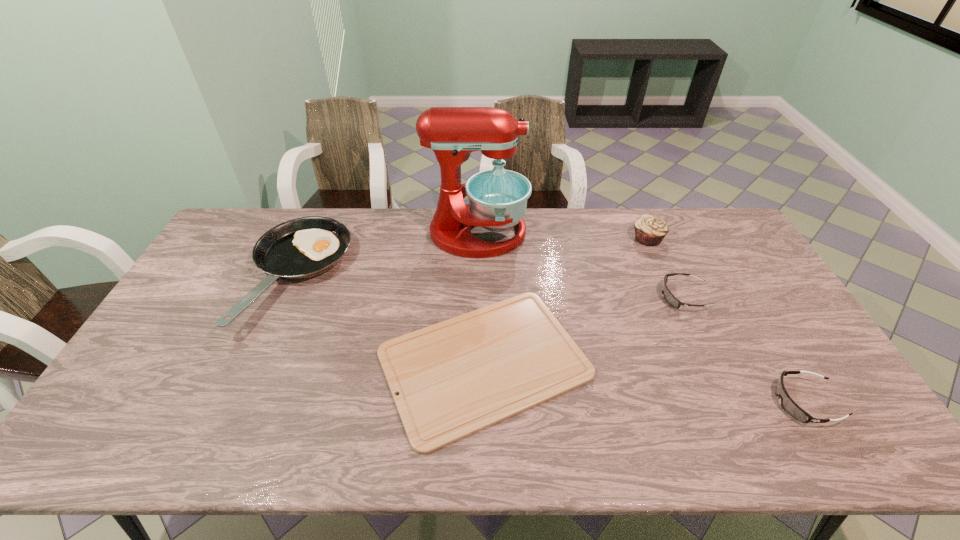
Where is `frying pan at the far edge`? frying pan at the far edge is located at coordinates (301, 248).

I want to click on goggles present at the near edge, so click(x=790, y=407).

What are the coordinates of `chopping board situated at the near edge` in the screenshot? It's located at (454, 378).

Find the location of `object located at the right edge`. object located at the right edge is located at coordinates (790, 407).

Find the location of a particular element. The image size is (960, 540). object that is at the near right corner is located at coordinates (790, 407).

In the image, there is a desktop. At what (x,y) coordinates should I click in order to perform the action: click on vacant space at the far edge. Please return your answer as a coordinate pair (x, y). This screenshot has width=960, height=540. Looking at the image, I should click on (584, 212).

Identify the location of vacant space at the left edge. tap(117, 418).

Image resolution: width=960 pixels, height=540 pixels. I want to click on vacant region at the right edge of the desktop, so click(x=760, y=329).

This screenshot has width=960, height=540. I want to click on free region at the far right corner, so click(x=707, y=244).

The height and width of the screenshot is (540, 960). What are the coordinates of `free space between the left goggles and the right goggles` in the screenshot? It's located at (745, 349).